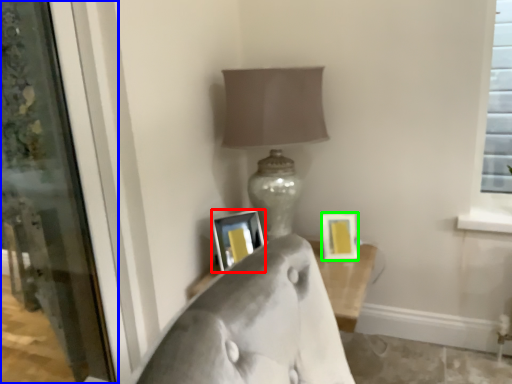
Question: Which object is positioned closest to picture frame (highlighted by a red box)? Select from screen door (highlighted by a blue box) and picture frame (highlighted by a green box).

Choices:
 (A) screen door
 (B) picture frame

Answer: (B)